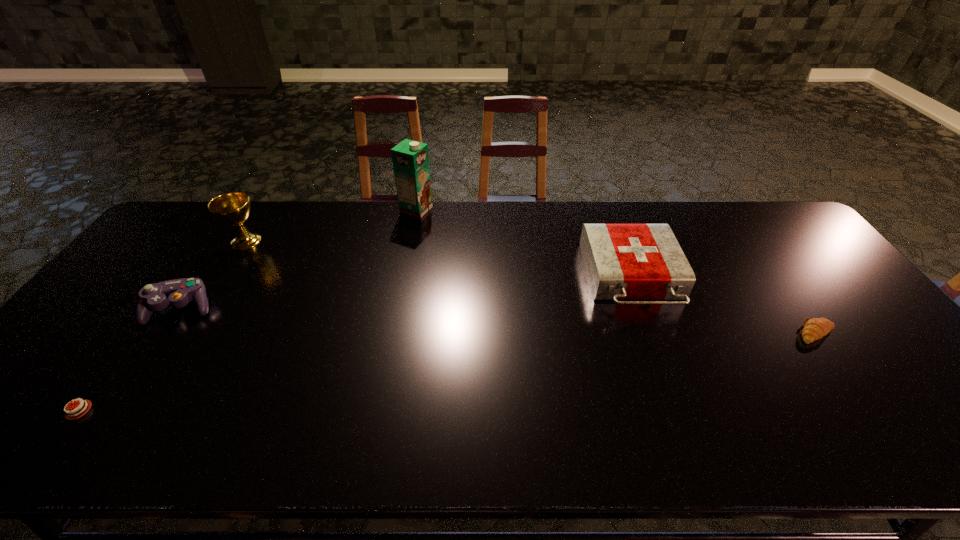
Locate an element on the screen. vacant space that satisfies the following two spatial constraints: 1. on the front side of the second object from right to left; 2. on the left side of the rightmost object is located at coordinates (652, 333).

Identify the location of vacant point that satisfies the following two spatial constraints: 1. on the front side of the second shortest object; 2. on the right side of the control. The image size is (960, 540). (164, 333).